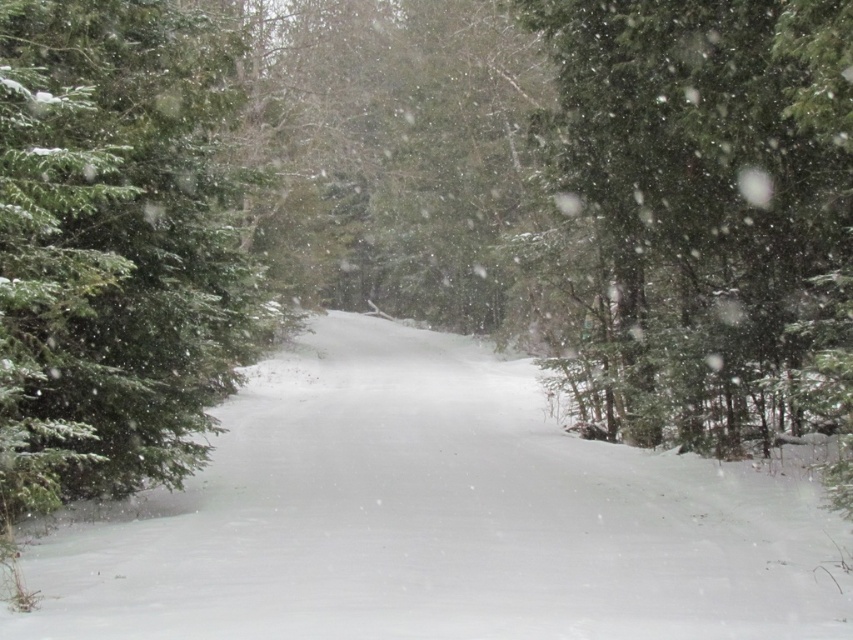
You are standing at the center of the snow path in the winter forest scene. You see a green matte evergreen tree at left. Where is the green matte evergreen tree positioned relative to your current location?

The green matte evergreen tree at left is located at point 0.384 on the horizontal axis and 0.137 on the vertical axis relative to your current position at the center of the snow path.

You are an observer standing at the bottom right corner of the image where the faint tracks are. You want to walk towards the dense cluster of trees in the background. Which object, the white fluffy snow at center or the green matte evergreen tree at left, will you encounter first along your path?

The white fluffy snow at center is smaller than the green matte evergreen tree at left, so you will encounter the white fluffy snow at center first along your path.